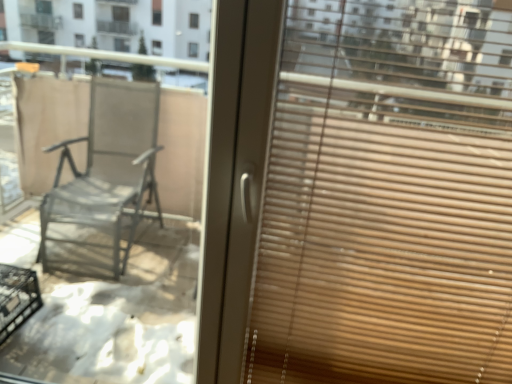
The height and width of the screenshot is (384, 512). Find the location of `wooden blinds at right`. wooden blinds at right is located at coordinates (387, 198).

Describe the element at coordinates (387, 198) in the screenshot. The height and width of the screenshot is (384, 512). I see `wooden blinds at right` at that location.

Measure the distance between wooden blinds at right and camera.

wooden blinds at right is 34.53 inches away from camera.

What do you see at coordinates (108, 233) in the screenshot?
I see `matte glass window at center` at bounding box center [108, 233].

The width and height of the screenshot is (512, 384). I want to click on matte glass window at center, so click(x=108, y=233).

Where is `wooden blinds at right`? wooden blinds at right is located at coordinates (387, 198).

Is wooden blinds at right at the right side of matte glass window at center?

Yes.

In the scene shown: Is wooden blinds at right further to camera compared to matte glass window at center?

No, it is in front of matte glass window at center.

Which is less distant, (x=441, y=26) or (x=89, y=225)?

Point (x=441, y=26)

From the picture: From the image's perspective, which object appears higher, wooden blinds at right or matte glass window at center?

matte glass window at center appears higher in the image.

From a real-world perspective, is wooden blinds at right on matte glass window at center?

Indeed, from a real-world perspective, wooden blinds at right stands above matte glass window at center.

Considering the relative sizes of wooden blinds at right and matte glass window at center in the image provided, is wooden blinds at right thinner than matte glass window at center?

In fact, wooden blinds at right might be wider than matte glass window at center.

Can you confirm if wooden blinds at right is taller than matte glass window at center?

No, wooden blinds at right is not taller than matte glass window at center.

Considering the sizes of objects wooden blinds at right and matte glass window at center in the image provided, who is smaller, wooden blinds at right or matte glass window at center?

Smaller between the two is matte glass window at center.

Could matte glass window at center be considered to be inside wooden blinds at right?

No, matte glass window at center is not surrounded by wooden blinds at right.

Are wooden blinds at right and matte glass window at center far apart?

Yes, wooden blinds at right and matte glass window at center are located far from each other.

Is wooden blinds at right positioned with its back to matte glass window at center?

wooden blinds at right does not have its back to matte glass window at center.

At what (x,y) coordinates should I click in order to perform the action: click on window blind lying on the right of matte glass window at center. Please return your answer as a coordinate pair (x, y). Looking at the image, I should click on (387, 198).

In the image, is matte glass window at center on the left side or the right side of wooden blinds at right?

matte glass window at center is to the left of wooden blinds at right.

Which object is closer to the camera taking this photo, matte glass window at center or wooden blinds at right?

wooden blinds at right is in front.

Based on the photo, which point is more distant from viewer, (180, 4) or (382, 181)?

The point (180, 4) is farther.

From the image's perspective, is matte glass window at center above or below wooden blinds at right?

Based on their image positions, matte glass window at center is located above wooden blinds at right.

From a real-world perspective, is matte glass window at center under wooden blinds at right?

Yes.

Between matte glass window at center and wooden blinds at right, which one has smaller width?

matte glass window at center is thinner.

Does matte glass window at center have a lesser height compared to wooden blinds at right?

No, matte glass window at center is not shorter than wooden blinds at right.

From the picture: Considering the relative sizes of matte glass window at center and wooden blinds at right in the image provided, is matte glass window at center bigger than wooden blinds at right?

No, matte glass window at center is not bigger than wooden blinds at right.

Is matte glass window at center spatially inside wooden blinds at right, or outside of it?

matte glass window at center lies outside wooden blinds at right.

Is matte glass window at center next to wooden blinds at right?

No, matte glass window at center is not touching wooden blinds at right.

Could you tell me if matte glass window at center is facing wooden blinds at right?

No, matte glass window at center is not facing towards wooden blinds at right.

How different are the orientations of matte glass window at center and wooden blinds at right in degrees?

There is a 0.00124-degree angle between the facing directions of matte glass window at center and wooden blinds at right.

How much distance is there between matte glass window at center and wooden blinds at right?

4.34 feet.

Find the location of `window above the wooden blinds at right (from the image's perspective)`. window above the wooden blinds at right (from the image's perspective) is located at coordinates (108, 233).

Locate an element on the screen. This screenshot has height=384, width=512. window on the left of the wooden blinds at right is located at coordinates (108, 233).

Where is `window blind in front of the matte glass window at center`? Image resolution: width=512 pixels, height=384 pixels. window blind in front of the matte glass window at center is located at coordinates (387, 198).